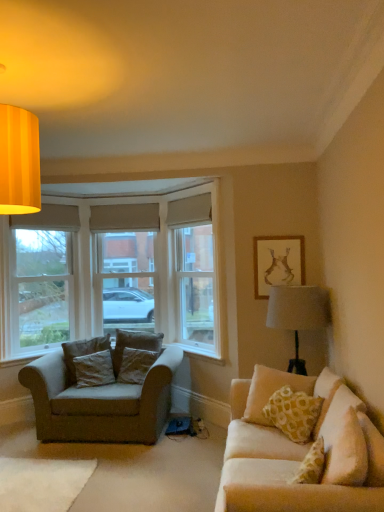
Question: Looking at the image, does white painted wood window frame at left seem bigger or smaller compared to matte gold picture frame at upper right?

Choices:
 (A) big
 (B) small

Answer: (A)

Question: Relative to matte gold picture frame at upper right, is white painted wood window frame at left in front or behind?

Choices:
 (A) behind
 (B) front

Answer: (A)

Question: Which of these objects is positioned farthest from the dark brown fabric pillow at left, the 2th pillow in the front-to-back sequence?

Choices:
 (A) velvet beige armchair at left
 (B) velvet beige pillow at right, which appears as the 1th pillow when viewed from the right
 (C) white painted wood window frame at left
 (D) matte gold picture frame at upper right
 (E) beige fabric window screen at center

Answer: (D)

Question: Estimate the real-world distances between objects in this image. Which object is farther from the velvet beige pillow at right, the fourth pillow in the left-to-right sequence?

Choices:
 (A) matte gold picture frame at upper right
 (B) textured beige pillow at center-left, which ranks as the third pillow in right-to-left order
 (C) dark brown fabric pillow at left, the third pillow viewed from the back
 (D) velvet beige armchair at left
 (E) dark gray fabric pillow at left, placed as the 2th pillow when sorted from right to left

Answer: (C)